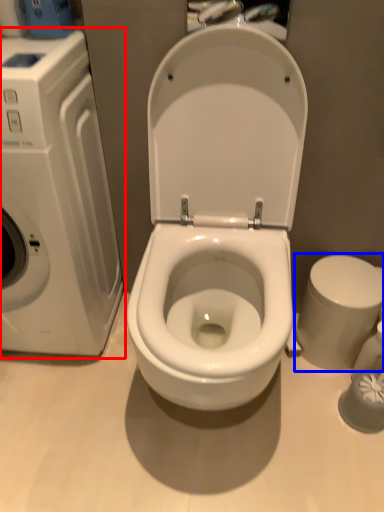
Question: Among these objects, which one is nearest to the camera, washing machine (highlighted by a red box) or bidet (highlighted by a blue box)?

Choices:
 (A) washing machine
 (B) bidet

Answer: (A)